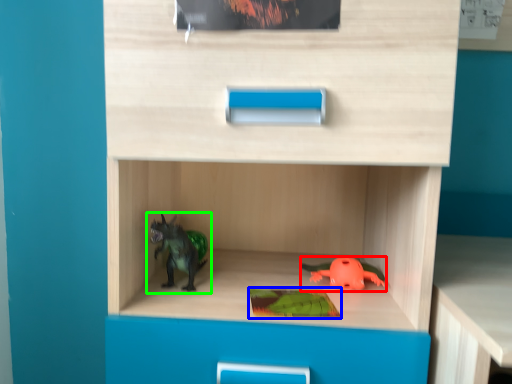
Question: Considering the real-world distances, which object is closest to toy (highlighted by a red box)? paperback book (highlighted by a blue box) or toy (highlighted by a green box).

Choices:
 (A) paperback book
 (B) toy

Answer: (A)